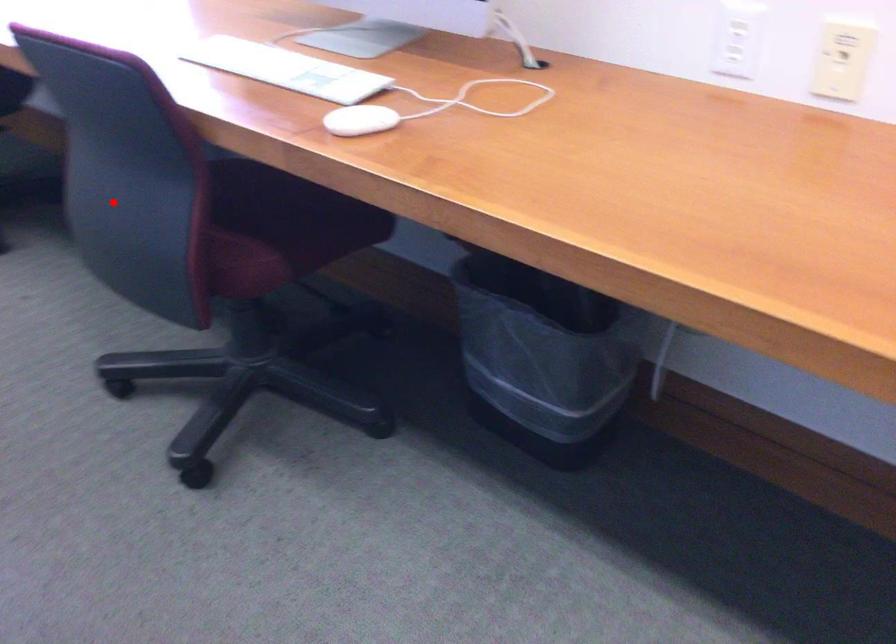
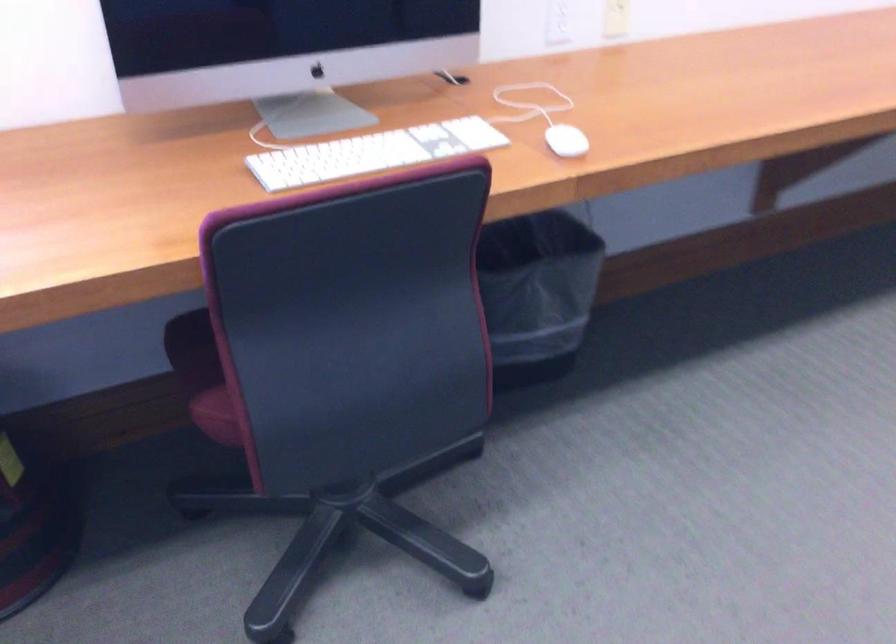
Locate, in the second image, the point that corresponds to the highlighted location in the first image.

(220, 413)